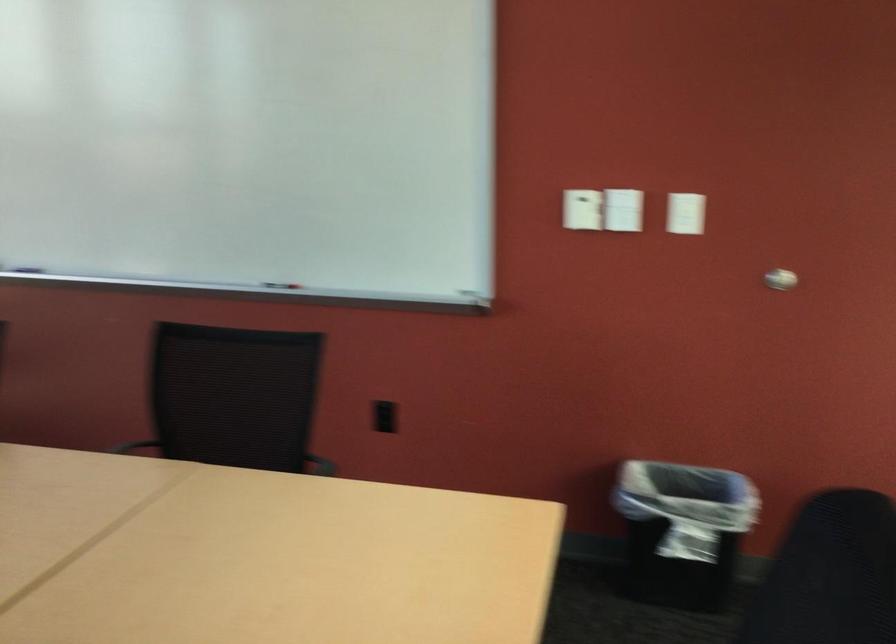
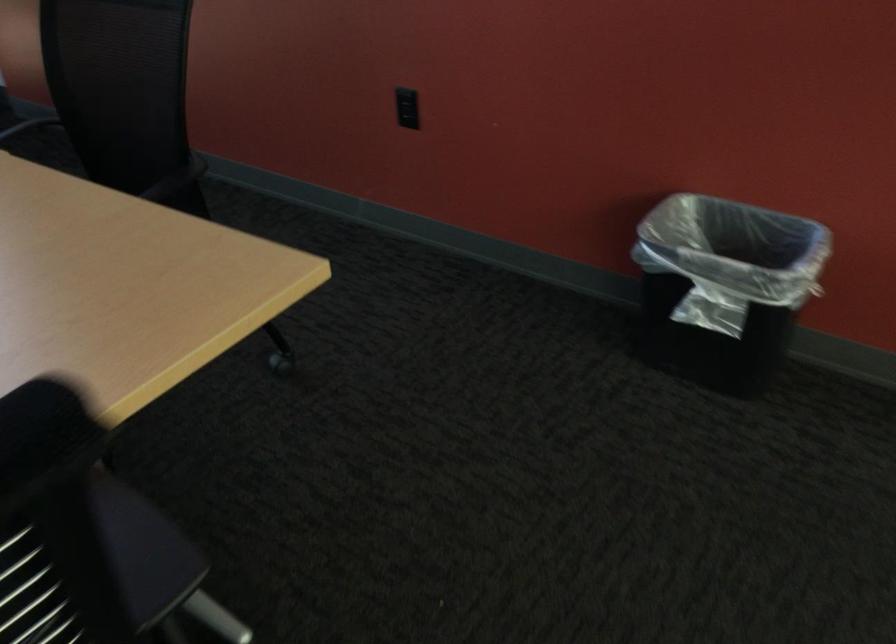
Find the pixel in the second image that matches point 397,410 in the first image.

(407, 102)